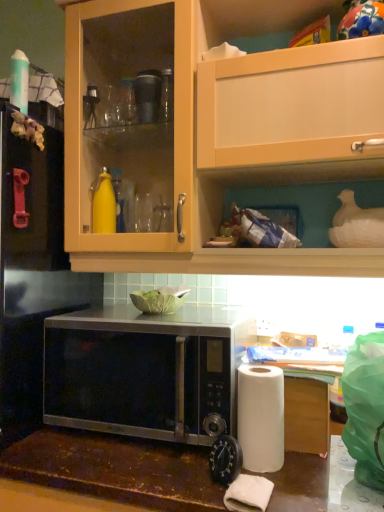
Locate an element on the screen. Image resolution: width=384 pixels, height=512 pixels. vacant area on top of black metallic microwave at center (from a real-world perspective) is located at coordinates (x=155, y=316).